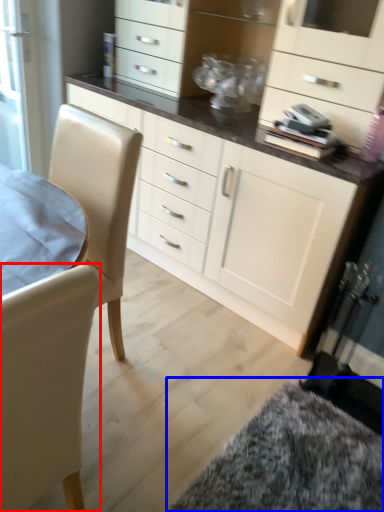
Question: Which point is further to the camera, chair (highlighted by a red box) or wide (highlighted by a blue box)?

Choices:
 (A) chair
 (B) wide

Answer: (B)